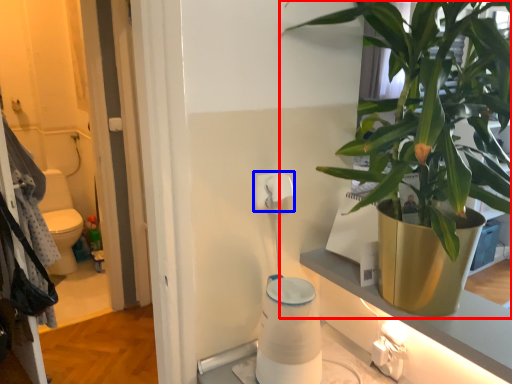
Question: Among these objects, which one is nearest to the camera, houseplant (highlighted by a red box) or toilet paper (highlighted by a blue box)?

Choices:
 (A) houseplant
 (B) toilet paper

Answer: (A)